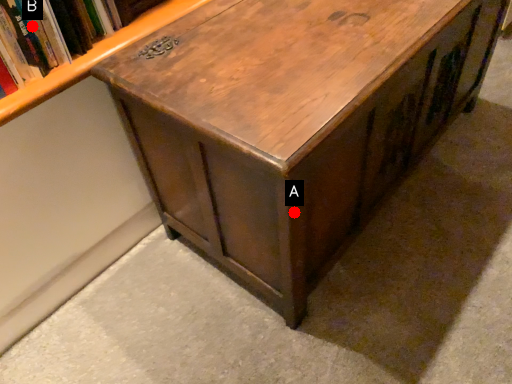
Question: Two points are circled on the image, labeled by A and B beside each circle. Which point is further to the camera?

Choices:
 (A) A is further
 (B) B is further

Answer: (B)